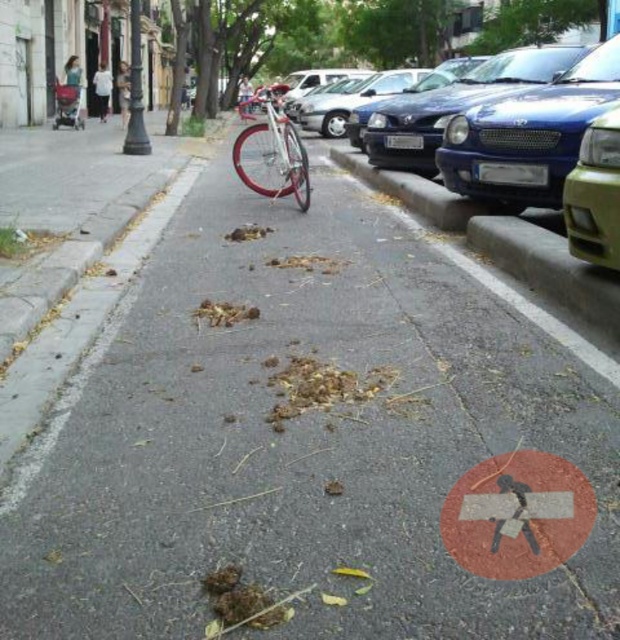
Which of these two, red painted pedestrian crossing sign at lower center or shiny silver bicycle at center, stands shorter?

Standing shorter between the two is red painted pedestrian crossing sign at lower center.

Who is positioned more to the left, red painted pedestrian crossing sign at lower center or shiny silver bicycle at center?

Positioned to the left is shiny silver bicycle at center.

You are a GUI agent. You are given a task and a screenshot of the screen. Output one action in this format:
    pyautogui.click(x=<x>, y=<y>)
    Task: Click on the red painted pedestrian crossing sign at lower center
    This screenshot has height=640, width=620.
    Given the screenshot: What is the action you would take?
    pyautogui.click(x=516, y=515)

I want to click on red painted pedestrian crossing sign at lower center, so [x=516, y=515].